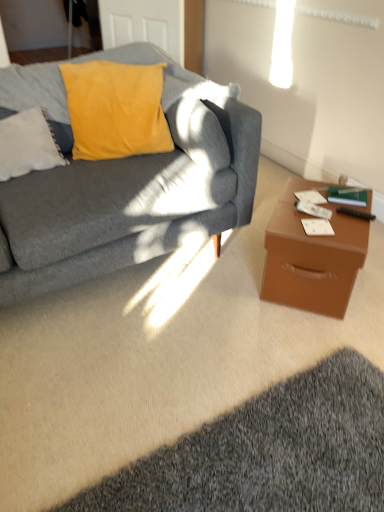
The width and height of the screenshot is (384, 512). Identify the location of vacant space that is to the left of black plastic remote control at right. (311, 218).